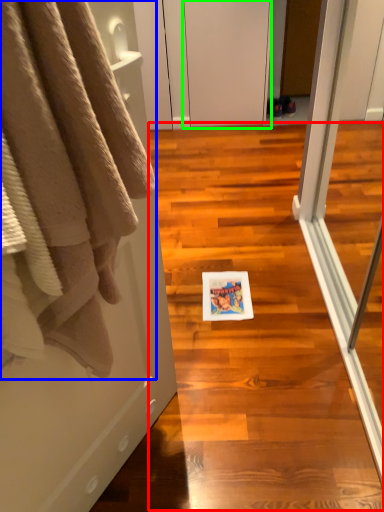
Question: Which is nearer to the stair (highlighted by a red box)? towel (highlighted by a blue box) or screen door (highlighted by a green box).

Choices:
 (A) towel
 (B) screen door

Answer: (A)